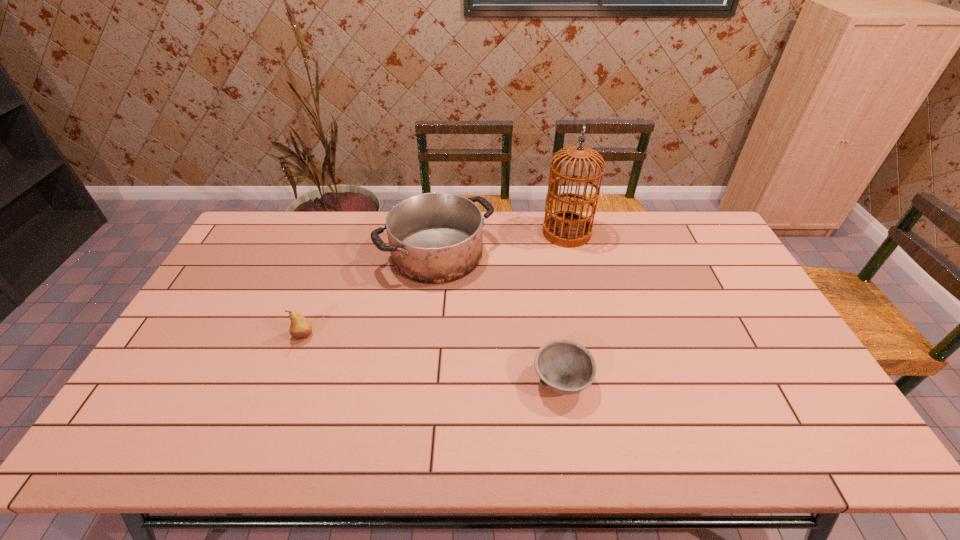
I want to click on birdcage present at the far edge, so click(569, 229).

The width and height of the screenshot is (960, 540). Identify the location of saucepan located in the far edge section of the desktop. (434, 238).

This screenshot has width=960, height=540. What are the coordinates of `vacant space at the far edge of the desktop` in the screenshot? It's located at (306, 246).

In the image, there is a desktop. Where is `free space at the near edge`? The height and width of the screenshot is (540, 960). free space at the near edge is located at coordinates (569, 425).

In the image, there is a desktop. What are the coordinates of `free space at the left edge` in the screenshot? It's located at (211, 319).

I want to click on free space at the right edge of the desktop, so click(x=748, y=323).

This screenshot has width=960, height=540. What are the coordinates of `vacant region at the far left corner` in the screenshot? It's located at (276, 217).

Locate an element on the screen. vacant space at the near right corner is located at coordinates (855, 451).

Where is `vacant point located between the second object from left to right and the birdcage`? vacant point located between the second object from left to right and the birdcage is located at coordinates (502, 243).

Locate an element on the screen. This screenshot has width=960, height=540. unoccupied position between the shortest object and the birdcage is located at coordinates (564, 307).